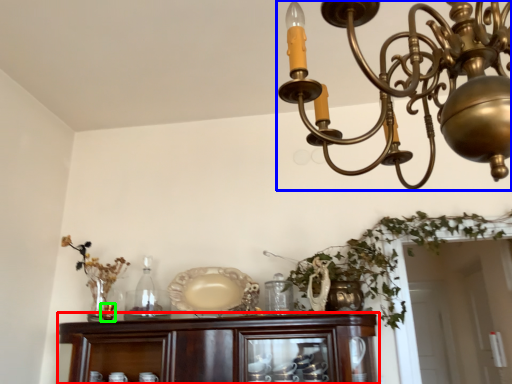
Question: Which is farther away from cabinetry (highlighted by a red box)? lamp (highlighted by a blue box) or candle holder (highlighted by a green box)?

Choices:
 (A) lamp
 (B) candle holder

Answer: (A)